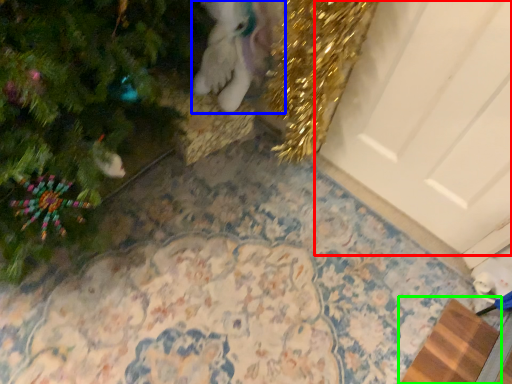
Question: Estimate the real-world distances between objects in this image. Which object is closer to door (highlighted by a red box), animal (highlighted by a blue box) or doormat (highlighted by a green box)?

Choices:
 (A) animal
 (B) doormat

Answer: (A)